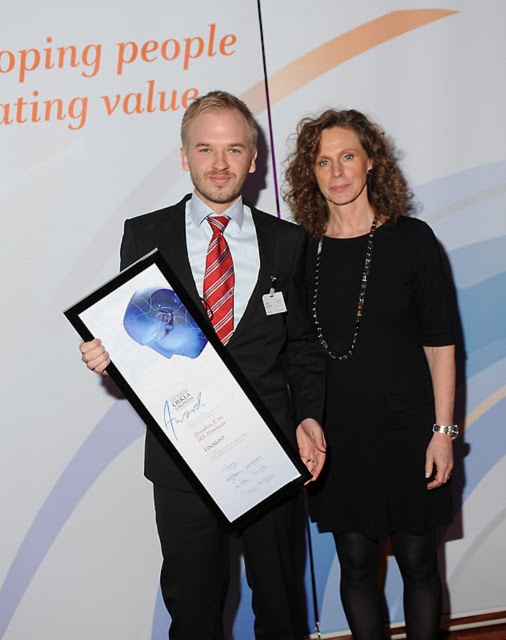
Question: Can you confirm if black matte dress at center is wider than matte black plaque at center?

Choices:
 (A) no
 (B) yes

Answer: (A)

Question: Which object is the farthest from the black matte dress at center?

Choices:
 (A) matte black plaque at center
 (B) matte black suit at center

Answer: (A)

Question: Among these objects, which one is nearest to the camera?

Choices:
 (A) matte black suit at center
 (B) matte black plaque at center
 (C) black matte dress at center

Answer: (B)

Question: Does matte black suit at center come behind matte black plaque at center?

Choices:
 (A) no
 (B) yes

Answer: (B)

Question: Does black matte dress at center have a smaller size compared to matte black plaque at center?

Choices:
 (A) no
 (B) yes

Answer: (A)

Question: Among these objects, which one is farthest from the camera?

Choices:
 (A) black matte dress at center
 (B) matte black plaque at center
 (C) matte black suit at center

Answer: (A)